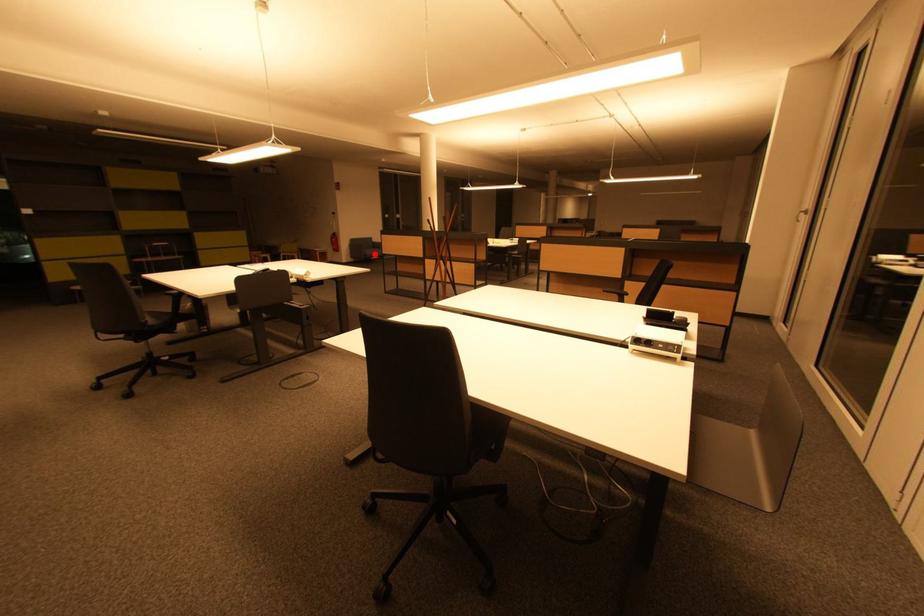
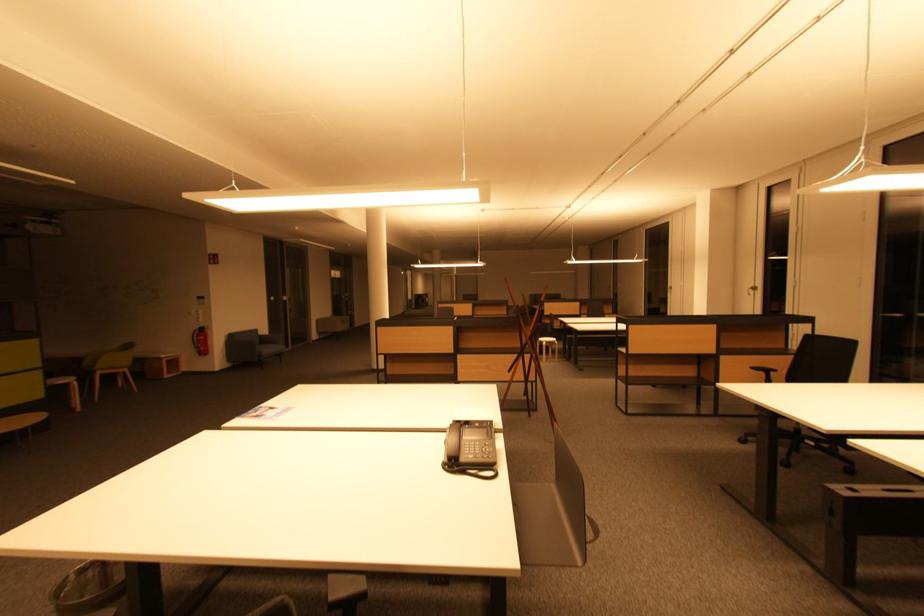
Question: I am providing you with two images of the same scene from different viewpoints. Given a red point in image1, look at the same physical point in image2. Is it:

Choices:
 (A) Closer to the viewpoint
 (B) Farther from the viewpoint

Answer: (A)